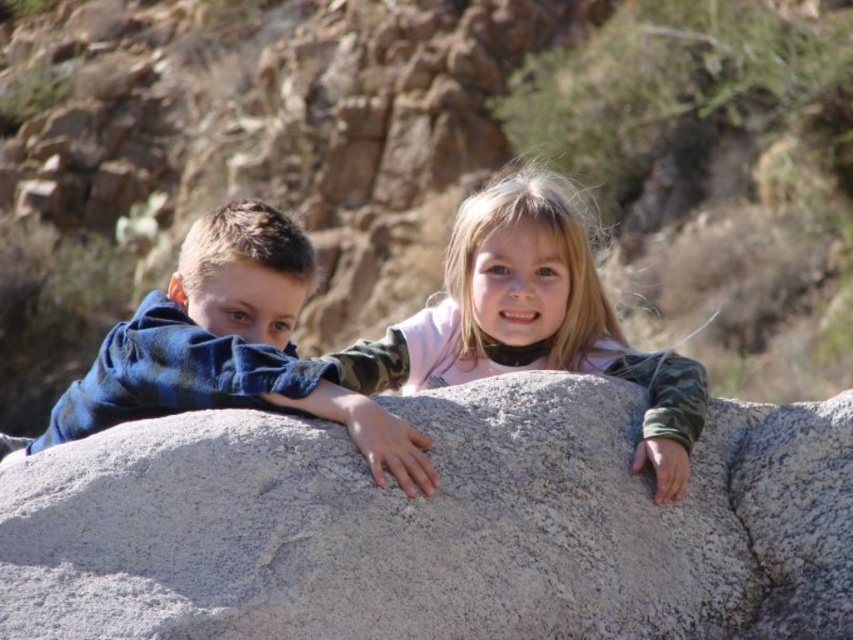
You are a photographer setting up a shot of the gray rough rock at center and the light pink fabric at center. Which object should you focus on first if you want to ensure both are in focus?

The gray rough rock at center is larger than the light pink fabric at center, so focusing on the gray rough rock at center first would help ensure both are in focus since it occupies more of the frame.

You are standing at the point with coordinates point (335, 372) and want to walk towards the point with coordinates point (691, 374). Will you be moving forward or backward relative to your current facing direction?

Since point (691, 374) is behind point (335, 372), you would be moving backward relative to your current facing direction.